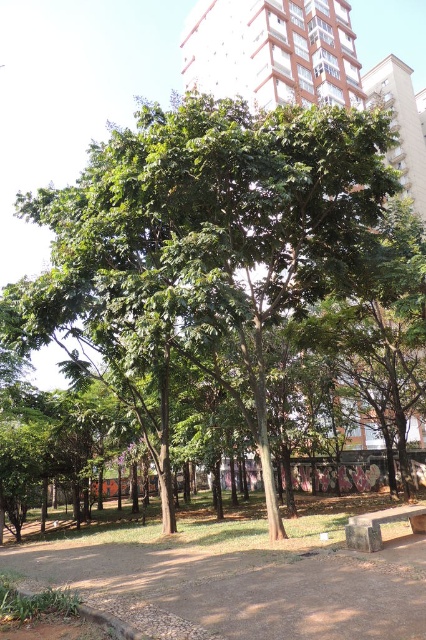
You are planning to place a new flower pot between the green leafy tree at center and the stone bench at lower right. Based on their sizes, which object should you consider for positioning the flower pot closer to?

The green leafy tree at center might be wider than the stone bench at lower right, so positioning the flower pot closer to the stone bench at lower right would leave enough space around the tree.

You are planning to place a new flower pot between the green leafy tree at center and the stone bench at lower right. Based on their positions, which object should the flower pot be closer to?

The green leafy tree at center is positioned on the left side of the stone bench at lower right, so the flower pot should be placed closer to the green leafy tree at center to maintain symmetry between the two objects.

You are standing at the center of the park and want to take a photo of the green leafy tree at center. Which direction should you face to ensure the tree is in the frame?

Since the green leafy tree at center is located at point (207, 248), you should face towards the center of the park to capture it in your photo.